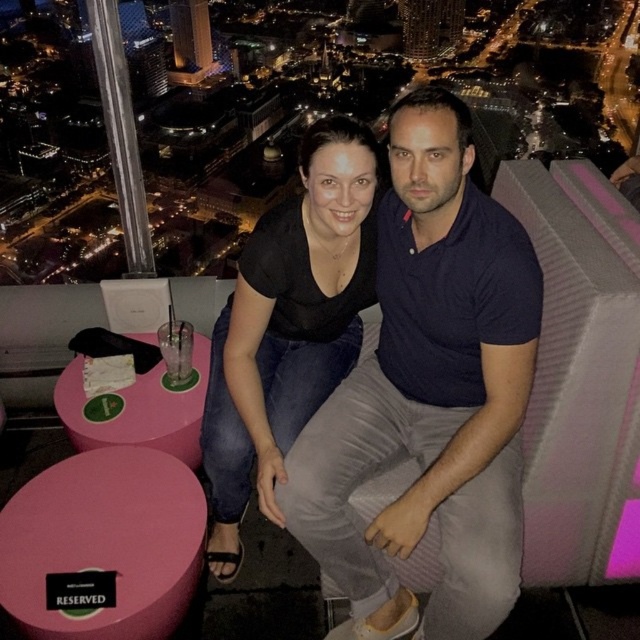
Does point (486, 228) lie in front of point (284, 276)?

That is True.

Who is positioned more to the left, dark blue cotton shirt at center or black matte shirt at center?

black matte shirt at center is more to the left.

Is point (468, 614) farther from camera compared to point (336, 264)?

No, it is in front of (336, 264).

Image resolution: width=640 pixels, height=640 pixels. What are the coordinates of `dark blue cotton shirt at center` in the screenshot? It's located at (429, 394).